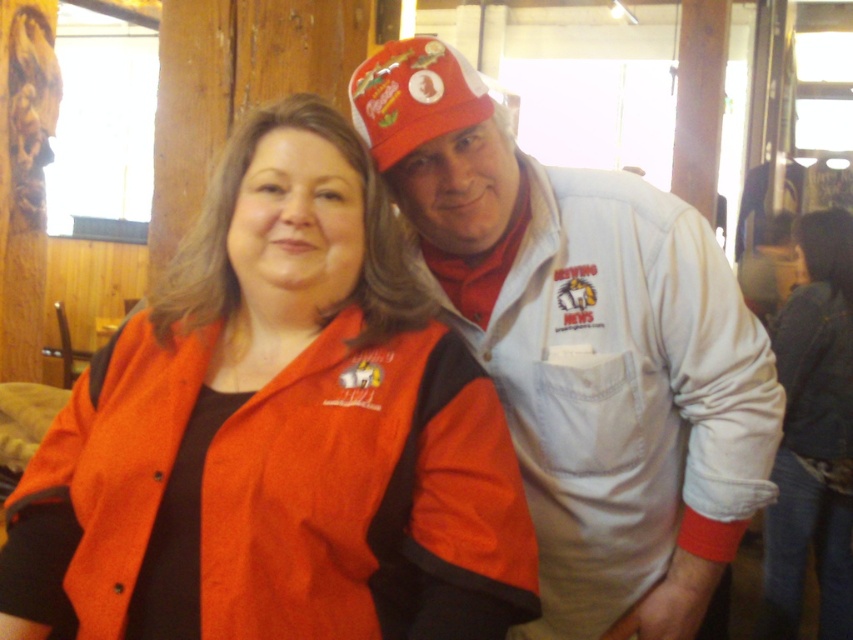
Question: Where is orange fabric jacket at center located in relation to matte red cap at upper center in the image?

Choices:
 (A) right
 (B) left

Answer: (B)

Question: Is orange fabric jacket at center thinner than matte red cap at upper center?

Choices:
 (A) yes
 (B) no

Answer: (B)

Question: From the image, what is the correct spatial relationship of orange fabric jacket at center in relation to white cotton shirt at upper right?

Choices:
 (A) right
 (B) left

Answer: (B)

Question: Estimate the real-world distances between objects in this image. Which object is closer to the matte red cap at upper center?

Choices:
 (A) orange fabric jacket at center
 (B) denim jacket at lower right
 (C) white cotton shirt at upper right

Answer: (C)

Question: Among these points, which one is farthest from the camera?

Choices:
 (A) (109, 611)
 (B) (712, 244)

Answer: (B)

Question: Estimate the real-world distances between objects in this image. Which object is closer to the denim jacket at lower right?

Choices:
 (A) orange fabric jacket at center
 (B) white cotton shirt at upper right
 (C) matte red cap at upper center

Answer: (B)